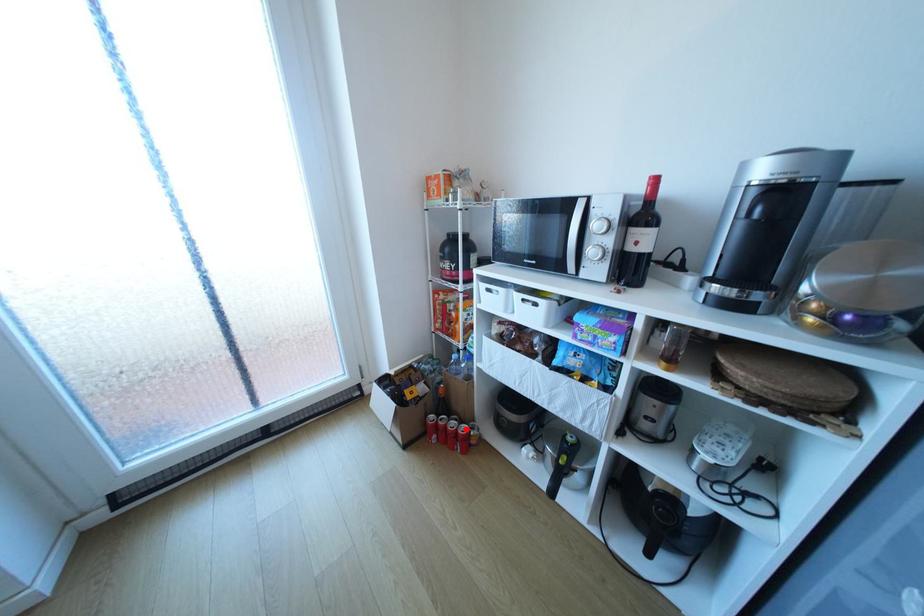
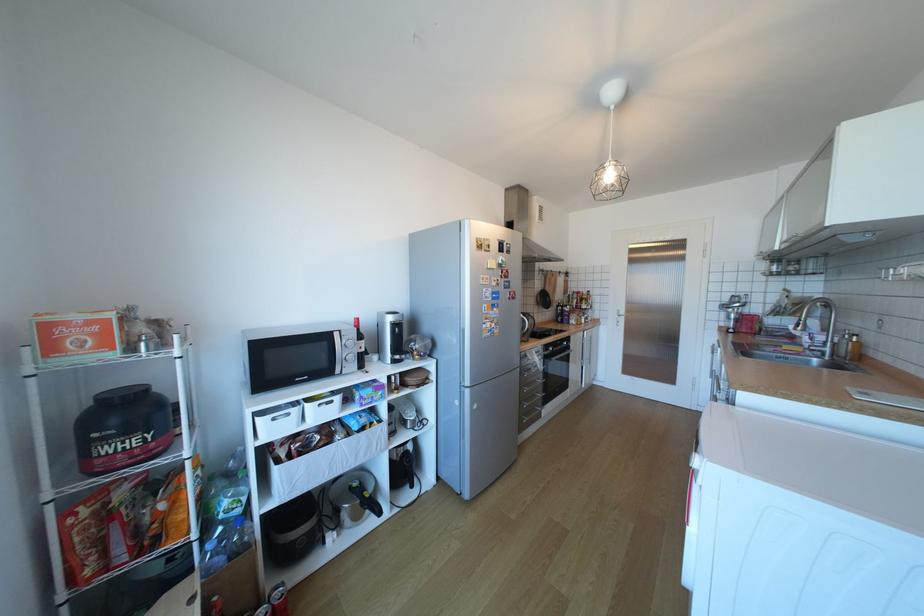
The point at the highlighted location is marked in the first image. Where is the corresponding point in the second image?

(283, 607)